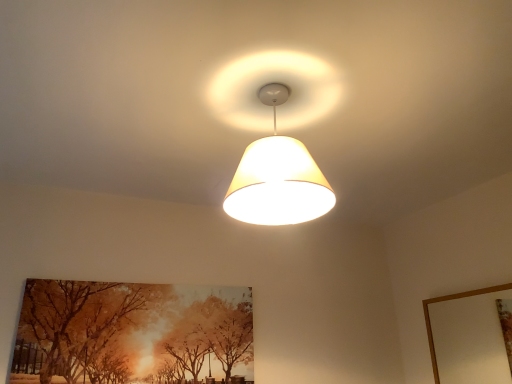
What is the approximate width of wooden picture frame at upper right?

2.59 inches.

In the scene shown: What is the approximate height of matte white lampshade at center?

15.01 inches.

The image size is (512, 384). What do you see at coordinates (277, 177) in the screenshot?
I see `matte white lampshade at center` at bounding box center [277, 177].

Find the location of a particular element. This screenshot has width=512, height=384. wooden picture frame at upper right is located at coordinates (447, 300).

Find the location of `lamp positioned vertically above the orange painted canvas at lower left (from a real-world perspective)`. lamp positioned vertically above the orange painted canvas at lower left (from a real-world perspective) is located at coordinates (277, 177).

Between matte white lampshade at center and orange painted canvas at lower left, which one has larger width?

With larger width is matte white lampshade at center.

Can you confirm if matte white lampshade at center is positioned to the left of orange painted canvas at lower left?

In fact, matte white lampshade at center is to the right of orange painted canvas at lower left.

Can we say matte white lampshade at center lies outside orange painted canvas at lower left?

Yes, matte white lampshade at center is outside of orange painted canvas at lower left.

Would you say orange painted canvas at lower left is outside matte white lampshade at center?

Yes, orange painted canvas at lower left is outside of matte white lampshade at center.

At what (x,y) coordinates should I click in order to perform the action: click on tree that appears below the matte white lampshade at center (from a real-world perspective). Please return your answer as a coordinate pair (x, y). Looking at the image, I should click on (77, 323).

From a real-world perspective, who is located higher, orange painted canvas at lower left or matte white lampshade at center?

In real-world perspective, matte white lampshade at center is above.

Based on the photo, from the image's perspective, would you say wooden picture frame at upper right is shown under matte white lampshade at center?

Yes.

Considering the positions of objects wooden picture frame at upper right and matte white lampshade at center in the image provided, who is in front, wooden picture frame at upper right or matte white lampshade at center?

matte white lampshade at center is in front.

Which is closer to the camera, (x=436, y=374) or (x=268, y=164)?

Positioned in front is point (x=268, y=164).

In terms of size, does wooden picture frame at upper right appear bigger or smaller than matte white lampshade at center?

Considering their sizes, wooden picture frame at upper right takes up less space than matte white lampshade at center.

Is orange painted canvas at lower left wider or thinner than wooden picture frame at upper right?

Considering their sizes, orange painted canvas at lower left looks slimmer than wooden picture frame at upper right.

From the image's perspective, is orange painted canvas at lower left located above or below wooden picture frame at upper right?

Based on their image positions, orange painted canvas at lower left is located above wooden picture frame at upper right.

Is orange painted canvas at lower left situated inside wooden picture frame at upper right or outside?

orange painted canvas at lower left is not enclosed by wooden picture frame at upper right.

This screenshot has height=384, width=512. In the image, there is a wooden picture frame at upper right. In order to click on tree above it (from the image's perspective) in this screenshot , I will do `click(77, 323)`.

Is wooden picture frame at upper right bigger or smaller than orange painted canvas at lower left?

wooden picture frame at upper right is smaller than orange painted canvas at lower left.

Consider the image. Between wooden picture frame at upper right and orange painted canvas at lower left, which one appears on the left side from the viewer's perspective?

Positioned to the left is orange painted canvas at lower left.

Does wooden picture frame at upper right have a lesser width compared to orange painted canvas at lower left?

No, wooden picture frame at upper right is not thinner than orange painted canvas at lower left.

Is wooden picture frame at upper right next to orange painted canvas at lower left and touching it?

There is a gap between wooden picture frame at upper right and orange painted canvas at lower left.

Is matte white lampshade at center looking in the opposite direction of wooden picture frame at upper right?

No, matte white lampshade at center is not facing the opposite direction of wooden picture frame at upper right.

Between matte white lampshade at center and wooden picture frame at upper right, which one has larger width?

Wider between the two is matte white lampshade at center.

From the image's perspective, relative to wooden picture frame at upper right, is matte white lampshade at center above or below?

matte white lampshade at center is above wooden picture frame at upper right.

Can wooden picture frame at upper right be found inside matte white lampshade at center?

No, wooden picture frame at upper right is not surrounded by matte white lampshade at center.

Locate an element on the screen. The image size is (512, 384). tree behind the matte white lampshade at center is located at coordinates 77,323.

Identify the location of tree on the left of matte white lampshade at center. (77, 323).

Based on the photo, based on their spatial positions, is orange painted canvas at lower left or wooden picture frame at upper right closer to matte white lampshade at center?

Among the two, orange painted canvas at lower left is located nearer to matte white lampshade at center.

From the image, which object appears to be farther from orange painted canvas at lower left, matte white lampshade at center or wooden picture frame at upper right?

wooden picture frame at upper right is positioned further to the anchor orange painted canvas at lower left.

Based on their spatial positions, is orange painted canvas at lower left or matte white lampshade at center further from wooden picture frame at upper right?

orange painted canvas at lower left is positioned further to the anchor wooden picture frame at upper right.

Estimate the real-world distances between objects in this image. Which object is further from matte white lampshade at center, wooden picture frame at upper right or orange painted canvas at lower left?

wooden picture frame at upper right is further to matte white lampshade at center.

Which object lies nearer to the anchor point orange painted canvas at lower left, wooden picture frame at upper right or matte white lampshade at center?

Among the two, matte white lampshade at center is located nearer to orange painted canvas at lower left.

From the picture: Based on their spatial positions, is matte white lampshade at center or orange painted canvas at lower left closer to wooden picture frame at upper right?

Among the two, matte white lampshade at center is located nearer to wooden picture frame at upper right.

Locate an element on the screen. The width and height of the screenshot is (512, 384). lamp between orange painted canvas at lower left and wooden picture frame at upper right is located at coordinates (277, 177).